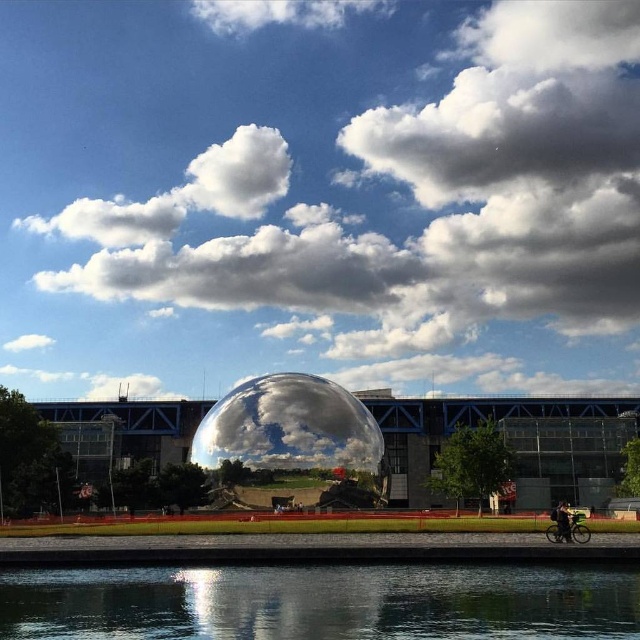
Question: Can you confirm if transparent glass water at lower center is wider than dark gray fabric jacket at lower right?

Choices:
 (A) yes
 (B) no

Answer: (A)

Question: Which point is farther from the camera taking this photo?

Choices:
 (A) (134, 410)
 (B) (364, 416)
 (C) (598, 609)
 (D) (566, 524)

Answer: (A)

Question: Is polished metallic sphere at center further to the viewer compared to dark gray fabric jacket at lower right?

Choices:
 (A) no
 (B) yes

Answer: (B)

Question: Considering the real-world distances, which object is closest to the transparent glass water at lower center?

Choices:
 (A) polished metallic sphere at center
 (B) dark gray fabric jacket at lower right
 (C) white fluffy cloud at center
 (D) transparent glass bubble at center

Answer: (B)

Question: Can you confirm if white fluffy cloud at center is positioned to the left of polished metallic sphere at center?

Choices:
 (A) no
 (B) yes

Answer: (B)

Question: Which point is closer to the camera?

Choices:
 (A) transparent glass water at lower center
 (B) white fluffy cloud at center
 (C) transparent glass bubble at center

Answer: (A)